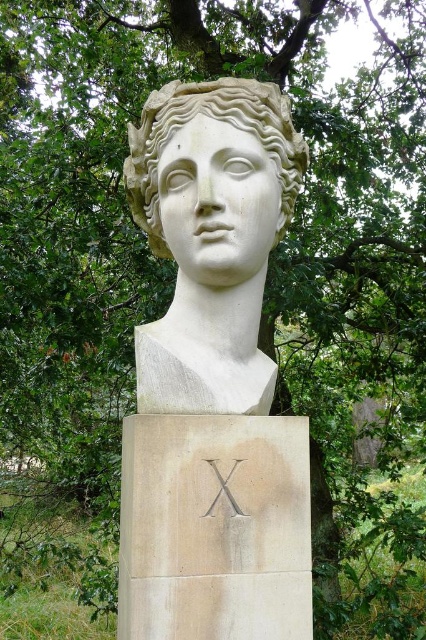
Question: Is white marble bust at center smaller than white marble head at center?

Choices:
 (A) no
 (B) yes

Answer: (A)

Question: Which point is closer to the camera taking this photo?

Choices:
 (A) (195, 388)
 (B) (267, 99)

Answer: (A)

Question: Which object is farther from the camera taking this photo?

Choices:
 (A) white marble bust at center
 (B) white marble head at center

Answer: (B)

Question: Which object is farther from the camera taking this photo?

Choices:
 (A) white marble head at center
 (B) white marble bust at center

Answer: (A)

Question: Does white marble bust at center appear on the left side of white marble head at center?

Choices:
 (A) yes
 (B) no

Answer: (A)

Question: Is white marble bust at center to the right of white marble head at center from the viewer's perspective?

Choices:
 (A) yes
 (B) no

Answer: (B)